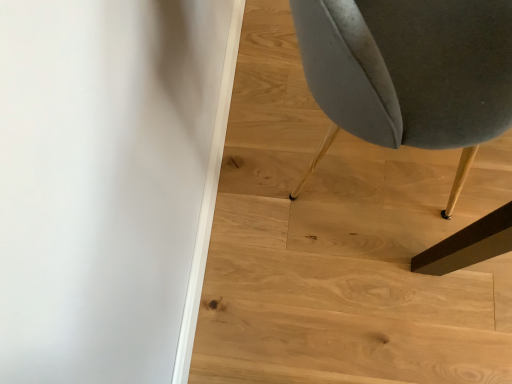
Where is `space that is in front of velvet grey chair at right`? space that is in front of velvet grey chair at right is located at coordinates (380, 285).